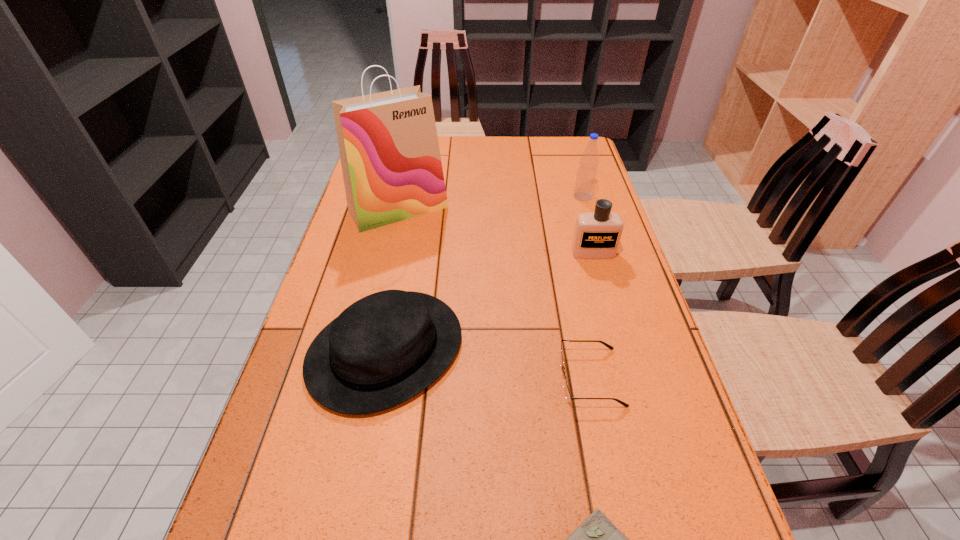
Locate an element on the screen. vacant area at the right edge is located at coordinates (683, 503).

Find the location of a particular element. empty location between the fourth nearest object and the fourth tallest object is located at coordinates (490, 301).

The image size is (960, 540). What are the coordinates of `free spot between the shopping bag and the fourth shortest object` in the screenshot? It's located at (496, 231).

Locate an element on the screen. vacant space that is in between the spectacles and the tallest object is located at coordinates (494, 293).

Locate an element on the screen. Image resolution: width=960 pixels, height=540 pixels. vacant area that lies between the spectacles and the shopping bag is located at coordinates (494, 293).

The image size is (960, 540). In order to click on vacant area between the perfume and the spectacles in this screenshot , I will do `click(591, 315)`.

Locate an element on the screen. The width and height of the screenshot is (960, 540). free point between the third shortest object and the water bottle is located at coordinates (485, 273).

This screenshot has width=960, height=540. I want to click on object that stands as the closest to the diary, so click(x=568, y=396).

This screenshot has height=540, width=960. Identify the location of the fourth closest object to the third tallest object. (388, 144).